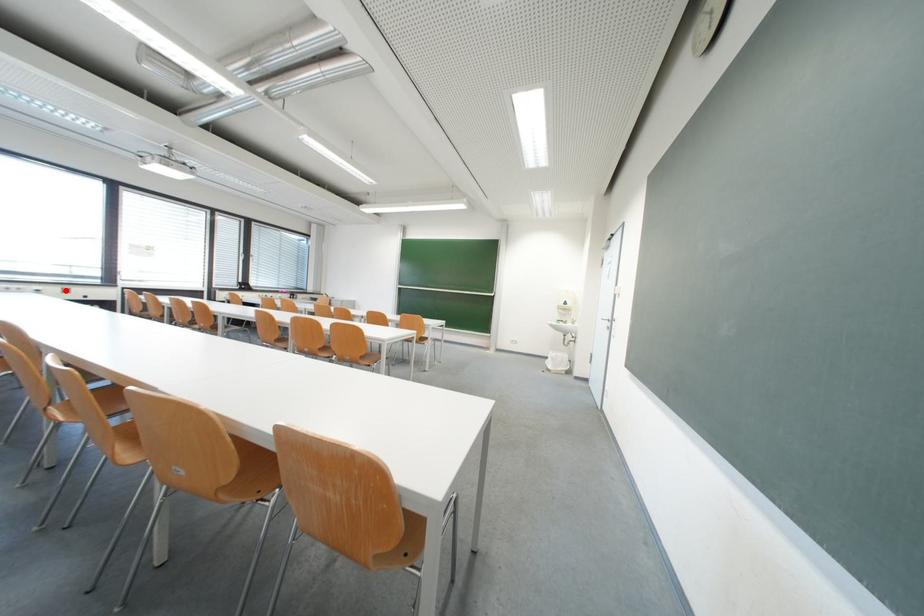
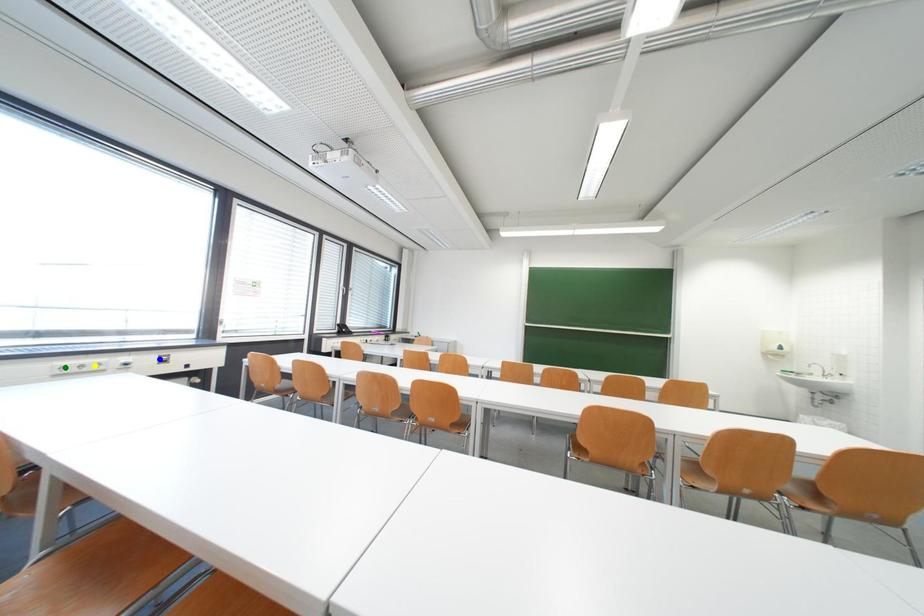
Question: I am providing you with two images of the same scene from different viewpoints. A red point is marked on the first image. You are given multiple points on the second image. Which point in image 2 is actually the same real-world point as the red point in image 1?

Choices:
 (A) yellow point
 (B) green point
 (C) blue point

Answer: (C)